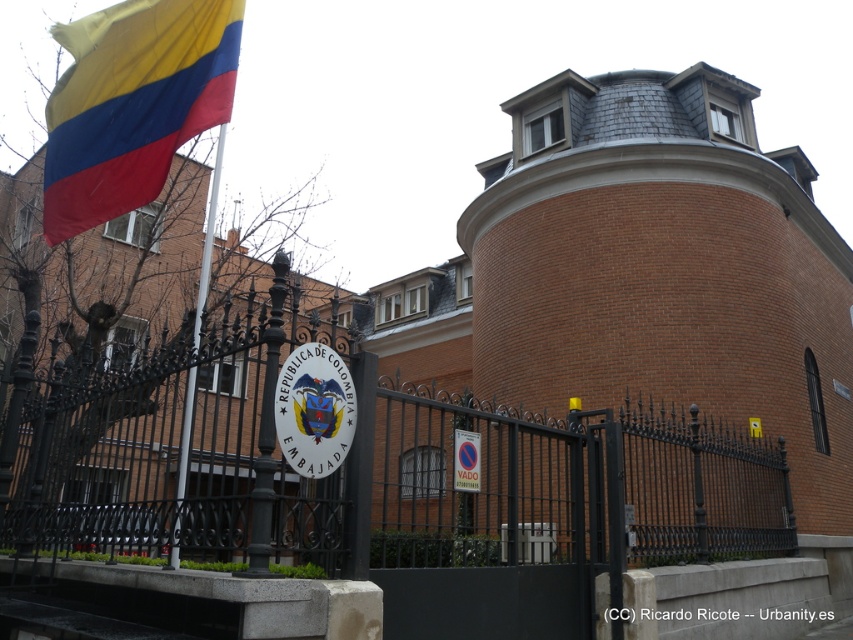
Does black wrought iron fence at center appear on the right side of polished metal flag pole at left?

Correct, you'll find black wrought iron fence at center to the right of polished metal flag pole at left.

Does black wrought iron fence at center have a lesser width compared to polished metal flag pole at left?

No.

Does point (257, 548) come in front of point (171, 536)?

Yes, it is in front of point (171, 536).

The height and width of the screenshot is (640, 853). I want to click on black wrought iron fence at center, so pos(363,472).

From the picture: Is matte fabric flag at upper left above polished metal flag pole at left?

No.

Based on the photo, does matte fabric flag at upper left have a greater height compared to polished metal flag pole at left?

In fact, matte fabric flag at upper left may be shorter than polished metal flag pole at left.

Which is in front, point (83, 19) or point (204, 294)?

Positioned in front is point (204, 294).

The image size is (853, 640). Find the location of `matte fabric flag at upper left`. matte fabric flag at upper left is located at coordinates (132, 104).

Does black wrought iron fence at center have a smaller size compared to matte fabric flag at upper left?

No.

Who is higher up, black wrought iron fence at center or matte fabric flag at upper left?

matte fabric flag at upper left is higher up.

Does point (512, 465) come farther from viewer compared to point (94, 192)?

That is True.

Where is `black wrought iron fence at center`? black wrought iron fence at center is located at coordinates (363, 472).